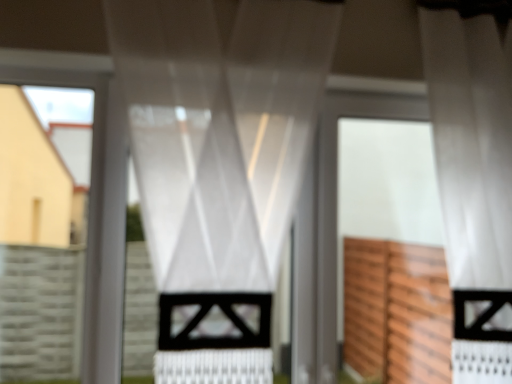
Describe the element at coordinates (474, 176) in the screenshot. I see `white sheer curtain at center, acting as the 1th curtain starting from the right` at that location.

Describe the element at coordinates (220, 129) in the screenshot. Image resolution: width=512 pixels, height=384 pixels. I see `satin white curtain at center, which is counted as the second curtain, starting from the right` at that location.

Locate an element on the screen. This screenshot has width=512, height=384. white sheer curtain at center, the 2th curtain from the left is located at coordinates (474, 176).

Is satin white curtain at center, which is counted as the second curtain, starting from the right, closer to camera compared to white sheer curtain at center, acting as the 1th curtain starting from the right?

Yes, the depth of satin white curtain at center, which is counted as the second curtain, starting from the right, is less than that of white sheer curtain at center, acting as the 1th curtain starting from the right.

This screenshot has height=384, width=512. I want to click on curtain above the white sheer curtain at center, the 2th curtain from the left (from the image's perspective), so click(x=220, y=129).

From a real-world perspective, which is physically above, white matte screen door at center or white sheer curtain at center, the 2th curtain from the left?

white sheer curtain at center, the 2th curtain from the left, from a real-world perspective.

Considering the sizes of objects white matte screen door at center and white sheer curtain at center, acting as the 1th curtain starting from the right, in the image provided, who is taller, white matte screen door at center or white sheer curtain at center, acting as the 1th curtain starting from the right,?

white sheer curtain at center, acting as the 1th curtain starting from the right.

Identify the location of screen door located behind the white sheer curtain at center, the 2th curtain from the left. (392, 253).

Is white matte screen door at center to the left or to the right of white sheer curtain at center, the 2th curtain from the left, in the image?

From the image, it's evident that white matte screen door at center is to the left of white sheer curtain at center, the 2th curtain from the left.

How different are the orientations of white sheer curtain at center, the 2th curtain from the left, and white matte screen door at center in degrees?

4.28 degrees separate the facing orientations of white sheer curtain at center, the 2th curtain from the left, and white matte screen door at center.

I want to click on the 2nd curtain above the white matte screen door at center (from a real-world perspective), so click(x=474, y=176).

From a real-world perspective, which is physically below, white sheer curtain at center, the 2th curtain from the left, or white matte screen door at center?

white matte screen door at center is physically lower.

Is the position of satin white curtain at center, which is the 1th curtain in left-to-right order, less distant than that of white matte screen door at center?

Yes, it is in front of white matte screen door at center.

From the image's perspective, is satin white curtain at center, which is the 1th curtain in left-to-right order, beneath white matte screen door at center?

Incorrect, from the image's perspective, satin white curtain at center, which is the 1th curtain in left-to-right order, is higher than white matte screen door at center.

Locate an element on the screen. Image resolution: width=512 pixels, height=384 pixels. screen door that is behind the satin white curtain at center, which is counted as the second curtain, starting from the right is located at coordinates (392, 253).

Considering the sizes of objects white sheer curtain at center, acting as the 1th curtain starting from the right, and satin white curtain at center, which is counted as the second curtain, starting from the right, in the image provided, who is wider, white sheer curtain at center, acting as the 1th curtain starting from the right, or satin white curtain at center, which is counted as the second curtain, starting from the right,?

Wider between the two is white sheer curtain at center, acting as the 1th curtain starting from the right.

Is white sheer curtain at center, the 2th curtain from the left, beside satin white curtain at center, which is the 1th curtain in left-to-right order?

No, white sheer curtain at center, the 2th curtain from the left, is not making contact with satin white curtain at center, which is the 1th curtain in left-to-right order.

From a real-world perspective, is white sheer curtain at center, acting as the 1th curtain starting from the right, beneath satin white curtain at center, which is counted as the second curtain, starting from the right?

Actually, white sheer curtain at center, acting as the 1th curtain starting from the right, is physically above satin white curtain at center, which is counted as the second curtain, starting from the right, in the real world.

From a real-world perspective, who is located higher, white matte screen door at center or satin white curtain at center, which is counted as the second curtain, starting from the right?

satin white curtain at center, which is counted as the second curtain, starting from the right, is physically above.

In the scene shown: Considering the sizes of objects white matte screen door at center and satin white curtain at center, which is counted as the second curtain, starting from the right, in the image provided, who is shorter, white matte screen door at center or satin white curtain at center, which is counted as the second curtain, starting from the right,?

white matte screen door at center.

Does white matte screen door at center have a greater width compared to satin white curtain at center, which is the 1th curtain in left-to-right order?

Correct, the width of white matte screen door at center exceeds that of satin white curtain at center, which is the 1th curtain in left-to-right order.

From the image's perspective, is white matte screen door at center positioned above or below satin white curtain at center, which is counted as the second curtain, starting from the right?

white matte screen door at center is below satin white curtain at center, which is counted as the second curtain, starting from the right.

You are a GUI agent. You are given a task and a screenshot of the screen. Output one action in this format:
    pyautogui.click(x=<x>, y=<y>)
    Task: Click on the curtain lying below the satin white curtain at center, which is counted as the second curtain, starting from the right (from the image's perspective)
    The width and height of the screenshot is (512, 384).
    Given the screenshot: What is the action you would take?
    pyautogui.click(x=474, y=176)

Locate an element on the screen. The image size is (512, 384). screen door behind the white sheer curtain at center, the 2th curtain from the left is located at coordinates (392, 253).

When comparing their distances from white matte screen door at center, does satin white curtain at center, which is counted as the second curtain, starting from the right, or white sheer curtain at center, the 2th curtain from the left, seem closer?

Based on the image, white sheer curtain at center, the 2th curtain from the left, appears to be nearer to white matte screen door at center.

When comparing their distances from satin white curtain at center, which is the 1th curtain in left-to-right order, does white matte screen door at center or white sheer curtain at center, the 2th curtain from the left, seem further?

white sheer curtain at center, the 2th curtain from the left, is further to satin white curtain at center, which is the 1th curtain in left-to-right order.

When comparing their distances from white sheer curtain at center, the 2th curtain from the left, does white matte screen door at center or satin white curtain at center, which is the 1th curtain in left-to-right order, seem closer?

The object closer to white sheer curtain at center, the 2th curtain from the left, is white matte screen door at center.

Which object lies nearer to the anchor point white sheer curtain at center, acting as the 1th curtain starting from the right, satin white curtain at center, which is counted as the second curtain, starting from the right, or white matte screen door at center?

white matte screen door at center is positioned closer to the anchor white sheer curtain at center, acting as the 1th curtain starting from the right.

Looking at this image, estimate the real-world distances between objects in this image. Which object is closer to white matte screen door at center, white sheer curtain at center, the 2th curtain from the left, or satin white curtain at center, which is counted as the second curtain, starting from the right?

white sheer curtain at center, the 2th curtain from the left, is closer to white matte screen door at center.

When comparing their distances from satin white curtain at center, which is the 1th curtain in left-to-right order, does white sheer curtain at center, the 2th curtain from the left, or white matte screen door at center seem closer?

white matte screen door at center lies closer to satin white curtain at center, which is the 1th curtain in left-to-right order, than the other object.

You are a GUI agent. You are given a task and a screenshot of the screen. Output one action in this format:
    pyautogui.click(x=<x>, y=<y>)
    Task: Click on the screen door located between satin white curtain at center, which is the 1th curtain in left-to-right order, and white sheer curtain at center, the 2th curtain from the left, in the left-right direction
    The image size is (512, 384).
    Given the screenshot: What is the action you would take?
    pyautogui.click(x=392, y=253)